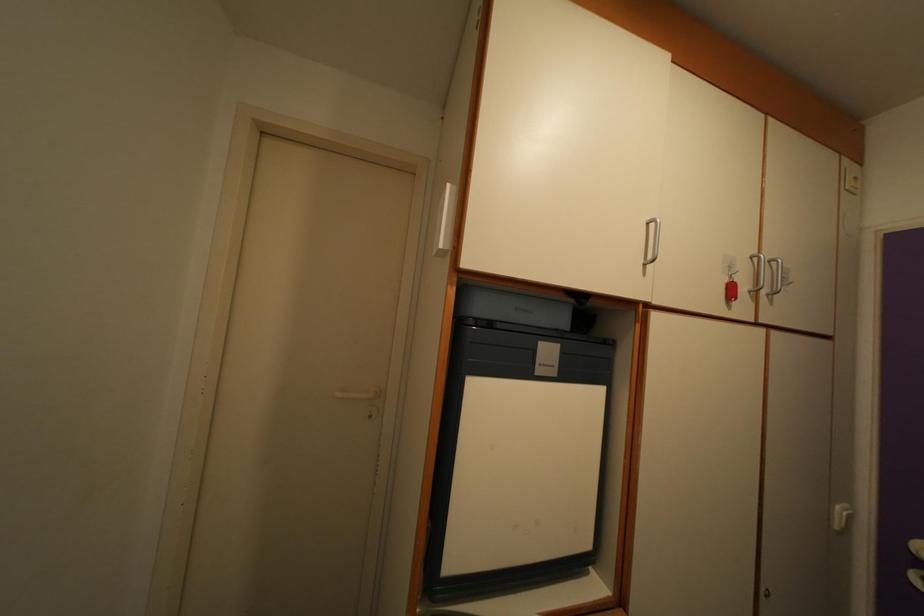
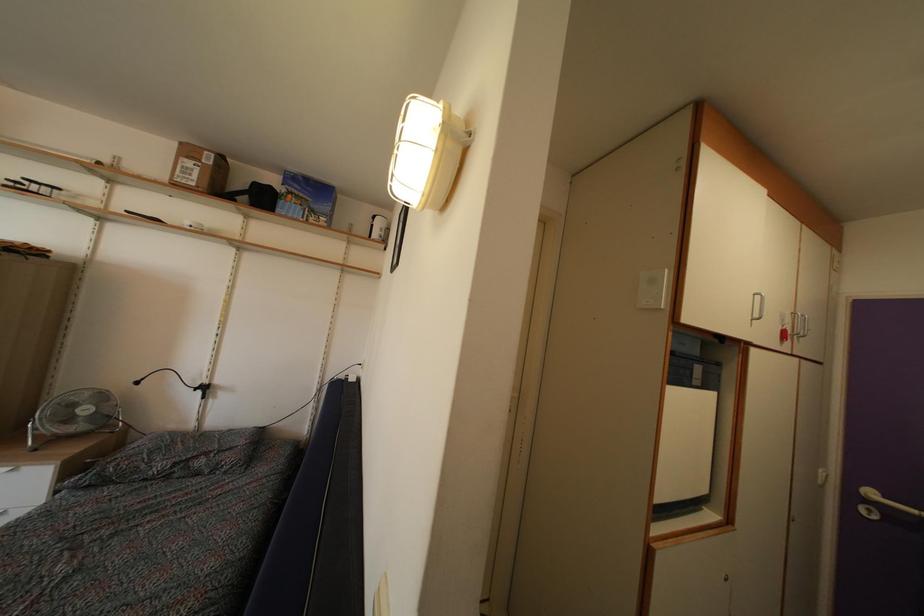
Question: Which direction would the cameraman need to move to produce the second image? Reply with the corresponding letter.

Choices:
 (A) Left
 (B) Right
 (C) Forward
 (D) Backward

Answer: (A)